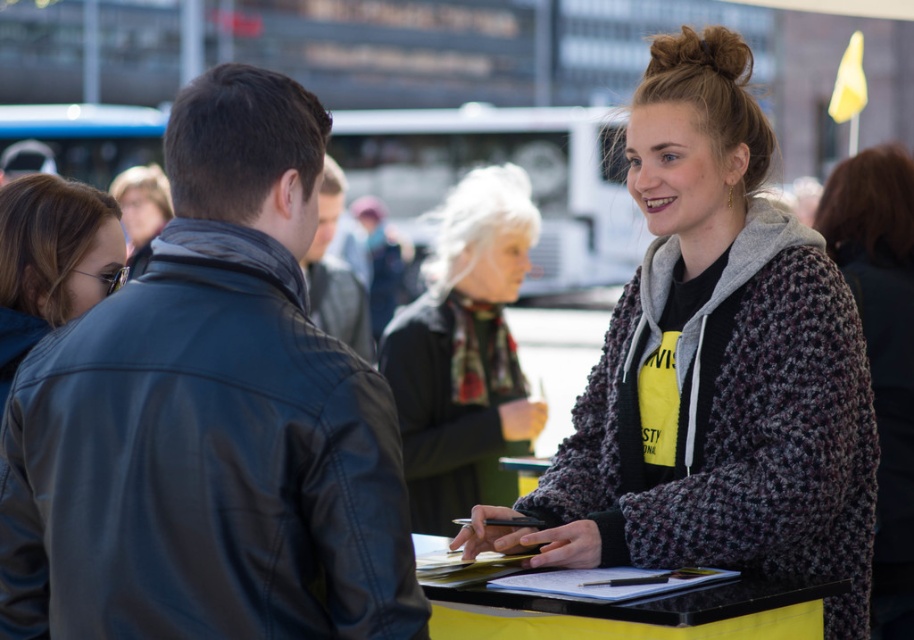
Question: Considering the real-world distances, which object is farthest from the knitted gray sweater at center?

Choices:
 (A) leather jacket at left
 (B) leather jacket at center

Answer: (B)

Question: Which point is closer to the camera?

Choices:
 (A) knitted gray cardigan at center
 (B) knitted gray sweater at center

Answer: (A)

Question: Does knitted gray cardigan at center come in front of leather jacket at center?

Choices:
 (A) yes
 (B) no

Answer: (A)

Question: Does leather jacket at left have a smaller size compared to leather jacket at center?

Choices:
 (A) yes
 (B) no

Answer: (B)

Question: Which object is farther from the camera taking this photo?

Choices:
 (A) leather jacket at center
 (B) knitted gray cardigan at center
 (C) leather jacket at left
 (D) fluffy gray sweater at center

Answer: (A)

Question: Does fluffy gray sweater at center appear on the right side of leather jacket at center?

Choices:
 (A) yes
 (B) no

Answer: (A)